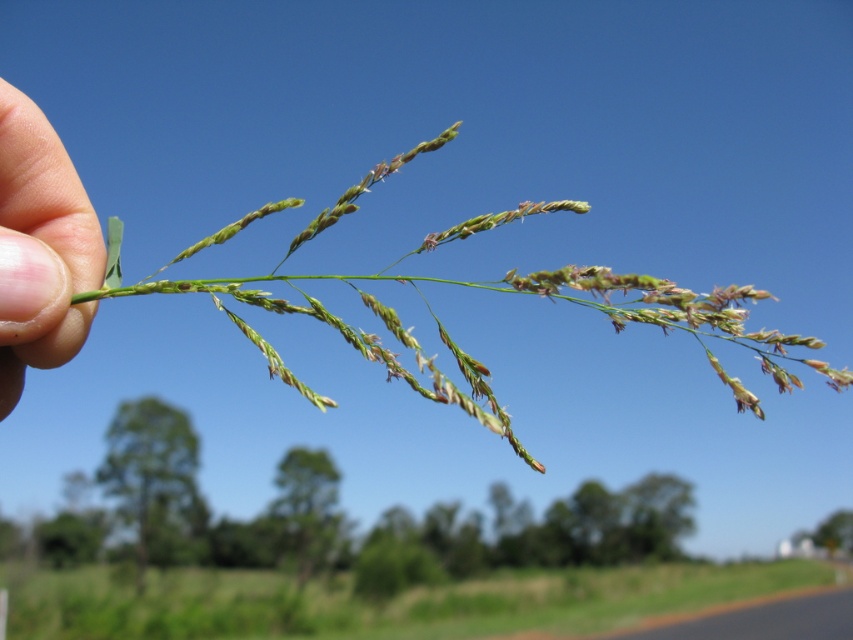
Does green leafy grass at lower center appear on the left side of green matte grass at upper left?

Yes, green leafy grass at lower center is to the left of green matte grass at upper left.

Does point (276, 612) come in front of point (688, 305)?

No, it is not.

Does point (654, 588) come closer to viewer compared to point (306, 230)?

No, (654, 588) is further to viewer.

Find the location of `green leafy grass at lower center`. green leafy grass at lower center is located at coordinates (376, 604).

Does point (788, 580) come behind point (20, 99)?

Yes.

Based on the photo, which of these two, green leafy grass at lower center or flesh-toned skin at left, stands shorter?

flesh-toned skin at left

Which is in front, point (548, 612) or point (55, 148)?

Point (55, 148) is in front.

The height and width of the screenshot is (640, 853). I want to click on green leafy grass at lower center, so click(376, 604).

Image resolution: width=853 pixels, height=640 pixels. Identify the location of green matte grass at upper left. (485, 289).

Is green matte grass at upper left further to the viewer compared to flesh-toned skin at left?

No, it is not.

Who is more distant from viewer, (619,323) or (33,132)?

Point (33,132)

At what (x,y) coordinates should I click in order to perform the action: click on green matte grass at upper left. Please return your answer as a coordinate pair (x, y). The width and height of the screenshot is (853, 640). Looking at the image, I should click on (485, 289).